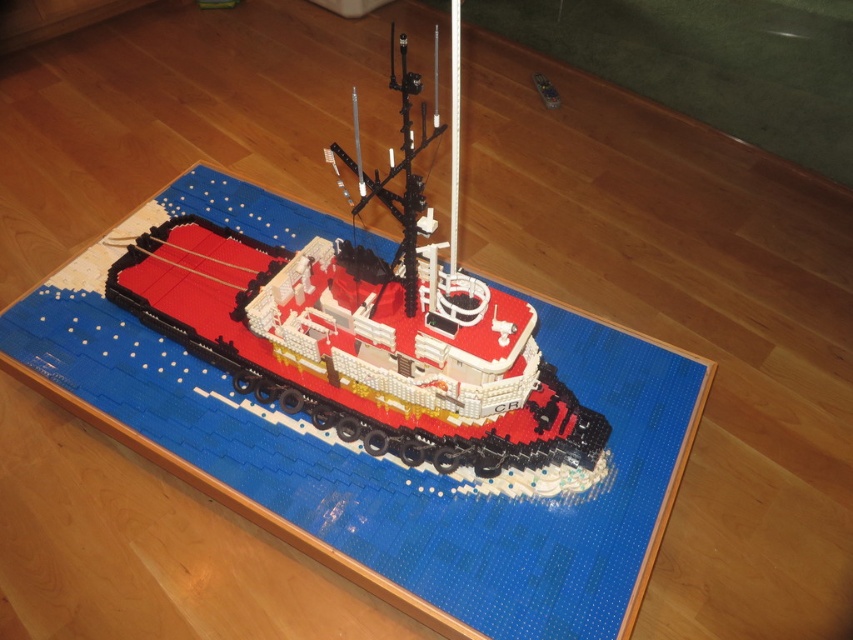
You are a toy organizer trying to store the brick red plastic boat at center on top of the blue plastic mat at center. Based on the scene description, will the boat fit on the mat without overhanging?

The blue plastic mat at center is much taller than the brick red plastic boat at center, so the boat will fit on the mat without overhanging.

You are a LEGO enthusiast examining the tugboat model. You notice the blue plastic mat at center and the brick red plastic boat at center. Which object is positioned lower in the scene?

The blue plastic mat at center is positioned below the brick red plastic boat at center, so it is lower in the scene.